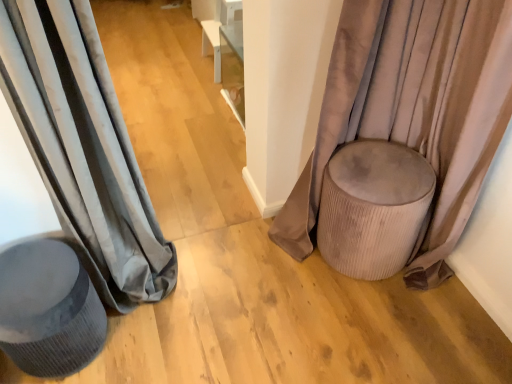
You are a GUI agent. You are given a task and a screenshot of the screen. Output one action in this format:
    pyautogui.click(x=<x>, y=<y>)
    Task: Click on the unoccupied region to the right of matte gray stool at left
    
    Given the screenshot: What is the action you would take?
    pyautogui.click(x=151, y=345)